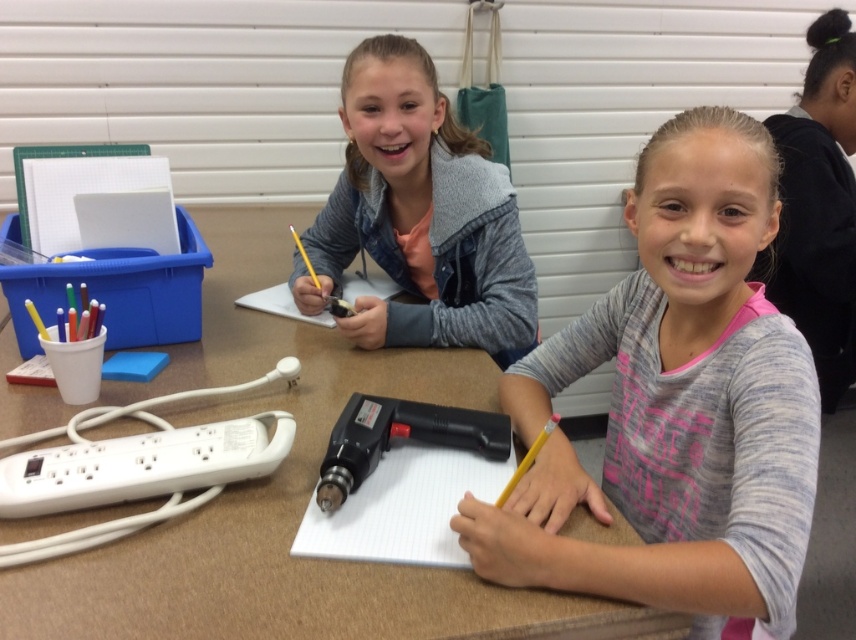
Does gray/white knit sweater at center have a lesser width compared to gray knit sweater at center?

Incorrect, gray/white knit sweater at center's width is not less than gray knit sweater at center's.

Looking at this image, does gray/white knit sweater at center have a greater width compared to gray knit sweater at center?

Indeed, gray/white knit sweater at center has a greater width compared to gray knit sweater at center.

What do you see at coordinates (676, 404) in the screenshot? I see `gray/white knit sweater at center` at bounding box center [676, 404].

Find the location of a particular element. This screenshot has height=640, width=856. gray/white knit sweater at center is located at coordinates (676, 404).

What do you see at coordinates (818, 208) in the screenshot? This screenshot has height=640, width=856. I see `gray knit sweater at center` at bounding box center [818, 208].

Does gray knit sweater at center have a lesser height compared to matte black pencil at center?

No, gray knit sweater at center is not shorter than matte black pencil at center.

Between point (815, 282) and point (346, 305), which one is positioned behind?

The point (815, 282) is behind.

What are the coordinates of `gray knit sweater at center` in the screenshot? It's located at (818, 208).

Looking at this image, is matte gray jacket at upper center taller than black plastic glue gun at center?

Yes.

Is point (373, 81) behind point (340, 460)?

Yes, it is behind point (340, 460).

Is point (444, 332) more distant than point (509, 449)?

Yes, it is.

This screenshot has width=856, height=640. I want to click on matte gray jacket at upper center, so click(x=419, y=216).